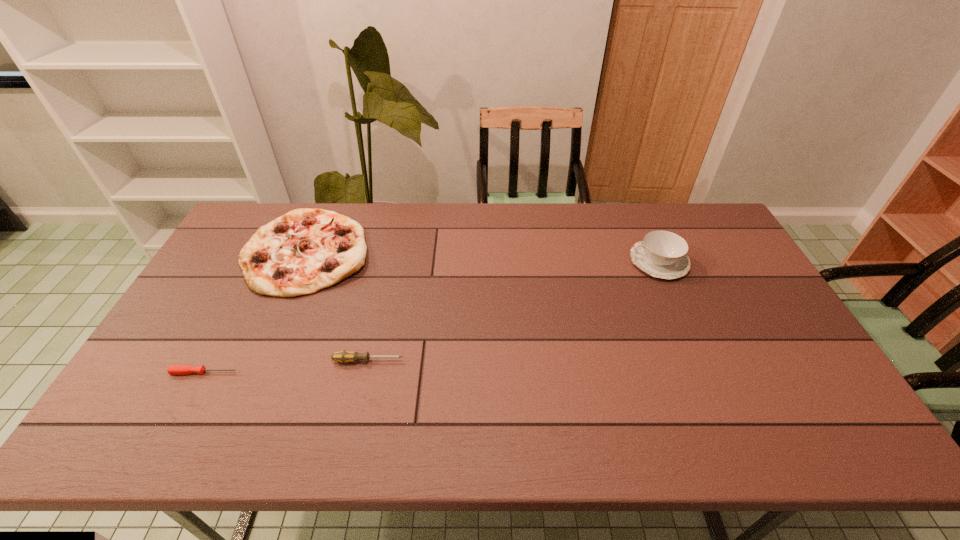
Identify the location of free region located on the right of the third shortest object. Image resolution: width=960 pixels, height=540 pixels. (391, 252).

I want to click on vacant space located 0.130m at the tip of the taller screwdriver, so click(453, 361).

This screenshot has width=960, height=540. Find the location of `free space located at the tip of the shorter screwdriver`. free space located at the tip of the shorter screwdriver is located at coordinates (276, 373).

Image resolution: width=960 pixels, height=540 pixels. What are the coordinates of `chinaware located at the far edge` in the screenshot? It's located at (662, 254).

Image resolution: width=960 pixels, height=540 pixels. In order to click on pizza at the far edge in this screenshot , I will do pyautogui.click(x=304, y=251).

Locate an element on the screen. pizza that is at the left edge is located at coordinates (304, 251).

Find the location of a particular element. The width and height of the screenshot is (960, 540). screwdriver that is at the left edge is located at coordinates (173, 369).

Locate an element on the screen. object positioned at the far left corner is located at coordinates (304, 251).

Identify the location of vacant area at the far edge. (462, 238).

Find the location of a particular element. vacant region at the near edge of the desktop is located at coordinates (351, 427).